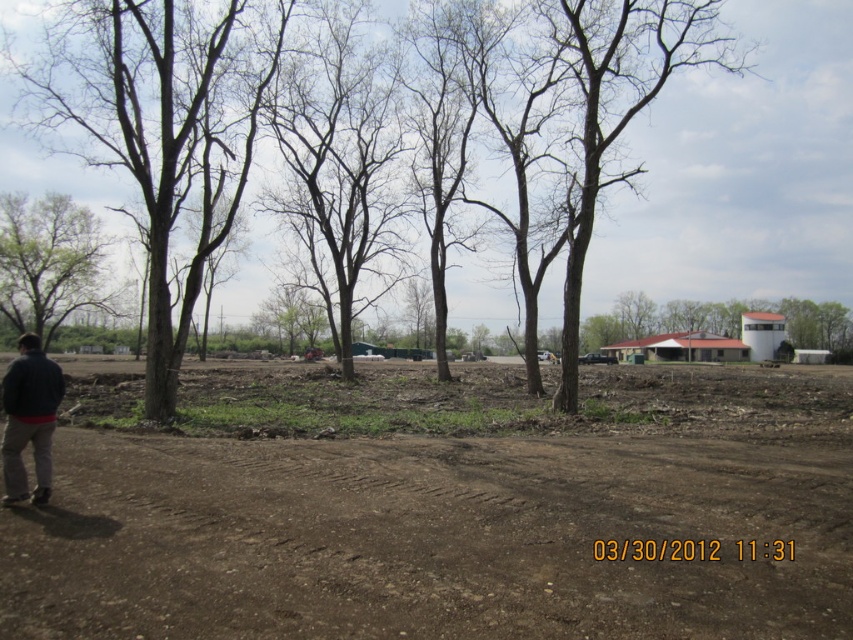
Which is above, brown dirt track at center or brown bark tree at center?

brown bark tree at center

Where is `brown dirt track at center`? brown dirt track at center is located at coordinates (427, 538).

Who is more distant from viewer, (339, 516) or (144, 28)?

The point (144, 28) is behind.

At what (x,y) coordinates should I click in order to perform the action: click on brown dirt track at center. Please return your answer as a coordinate pair (x, y). The image size is (853, 640). Looking at the image, I should click on (427, 538).

Is the position of brown bark tree at center less distant than that of dark gray jacket at lower left?

No, it is not.

Is brown bark tree at center smaller than dark gray jacket at lower left?

Incorrect, brown bark tree at center is not smaller in size than dark gray jacket at lower left.

Between point (210, 234) and point (3, 392), which one is positioned behind?

Point (210, 234)

Find the location of a particular element. This screenshot has height=640, width=853. brown bark tree at center is located at coordinates (163, 129).

Is brown bark tree at center further to the viewer compared to green leafy tree at left?

No.

Who is more forward, (193, 195) or (19, 282)?

Point (193, 195) is more forward.

From the picture: Who is more distant from viewer, (258, 64) or (9, 240)?

Point (9, 240)

In order to click on brown bark tree at center in this screenshot , I will do `click(163, 129)`.